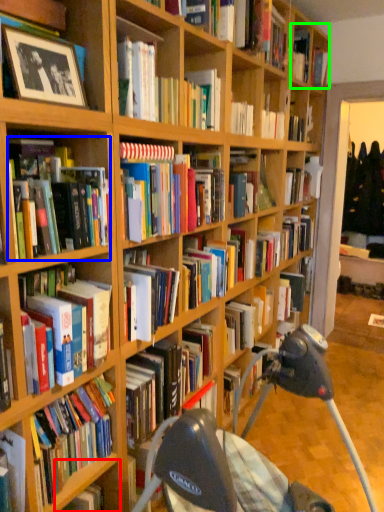
Question: Which is farther away from shelf (highlighted by a red box)? book (highlighted by a blue box) or book (highlighted by a green box)?

Choices:
 (A) book
 (B) book

Answer: (B)